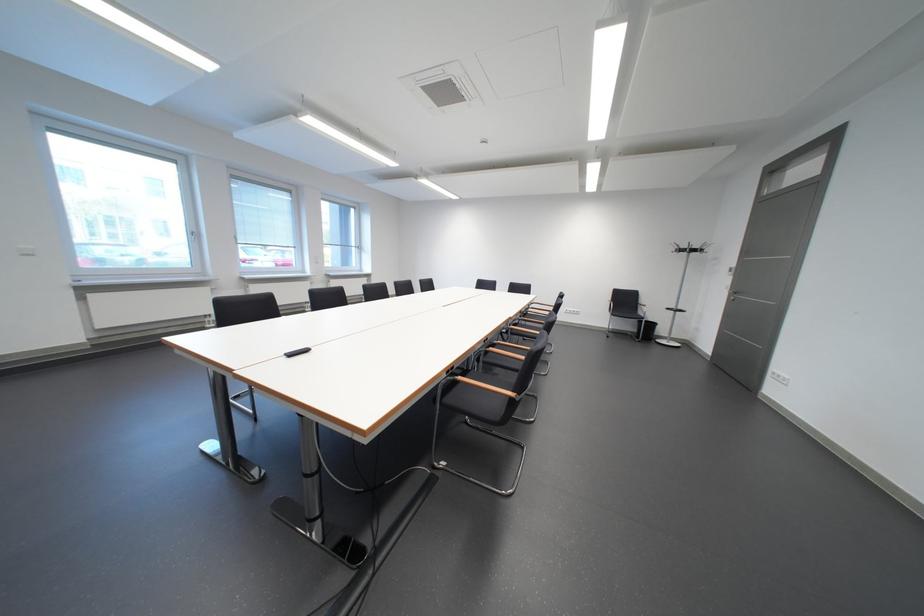
This screenshot has width=924, height=616. What are the coordinates of `black chair sitting surface` in the screenshot? It's located at (480, 395).